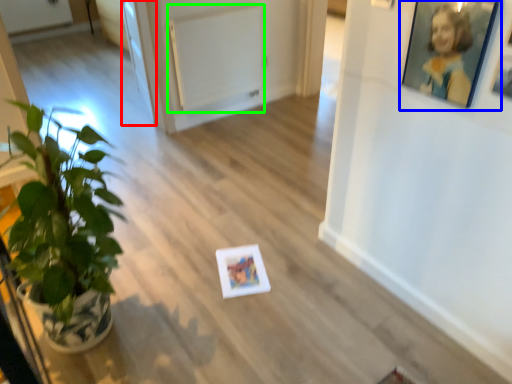
Question: Based on their relative distances, which object is farther from glass door (highlighted by a red box)? Choose from picture frame (highlighted by a blue box) and radiator (highlighted by a green box).

Choices:
 (A) picture frame
 (B) radiator

Answer: (A)